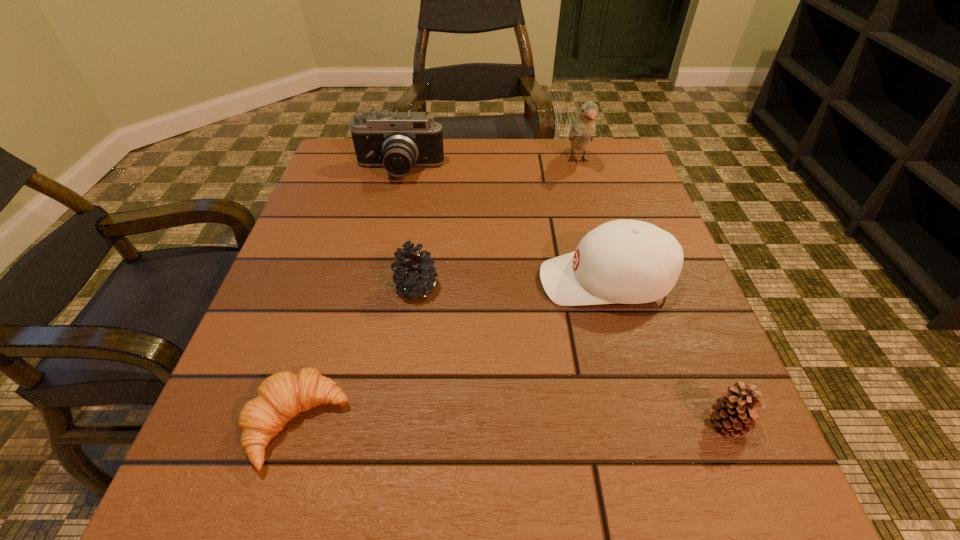
This screenshot has width=960, height=540. I want to click on crescent roll located in the left edge section of the desktop, so (x=282, y=396).

Identify the location of bird at the right edge. The height and width of the screenshot is (540, 960). (583, 130).

What are the coordinates of `baseball cap located at the right edge` in the screenshot? It's located at (623, 261).

Identify the location of pinecone that is at the right edge. (734, 412).

At what (x,y) coordinates should I click in order to perform the action: click on object that is at the far left corner. Please return your answer as a coordinate pair (x, y). Looking at the image, I should click on (397, 141).

Where is `object located in the near left corner section of the desktop`? The height and width of the screenshot is (540, 960). object located in the near left corner section of the desktop is located at coordinates (282, 396).

The width and height of the screenshot is (960, 540). Identify the location of object that is at the far right corner. (583, 130).

Find the location of `free space at the far edge of the desktop`. free space at the far edge of the desktop is located at coordinates (560, 158).

Find the location of `vacant region at the near edge of the desktop`. vacant region at the near edge of the desktop is located at coordinates click(472, 524).

Locate an element on the screen. The height and width of the screenshot is (540, 960). vacant area at the left edge of the desktop is located at coordinates tap(309, 450).